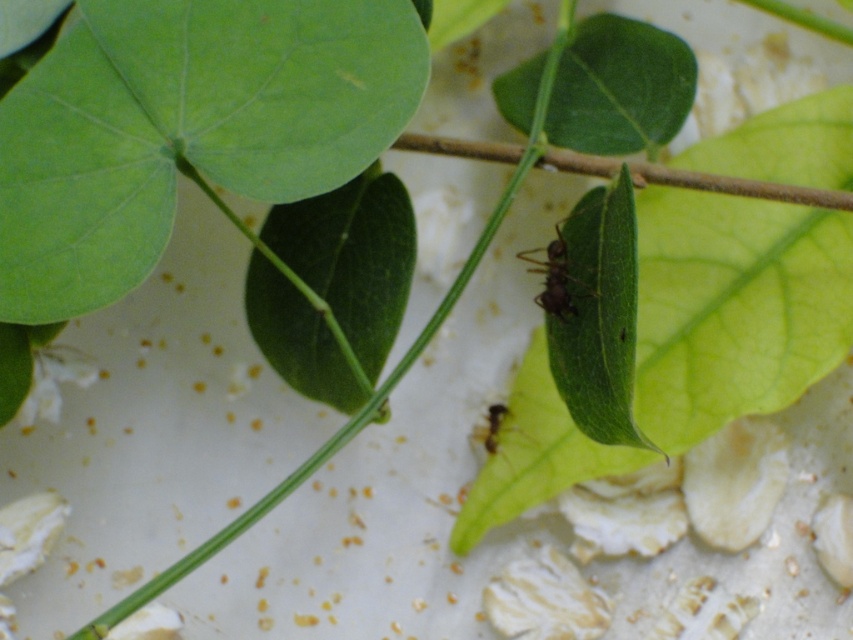
Question: Does brown matte ant at center have a larger size compared to green matte ant at center?

Choices:
 (A) no
 (B) yes

Answer: (B)

Question: Among these objects, which one is farthest from the camera?

Choices:
 (A) brown matte ant at center
 (B) green matte ant at center

Answer: (B)

Question: Among these objects, which one is farthest from the camera?

Choices:
 (A) green matte ant at center
 (B) green matte leaf at center
 (C) brown matte ant at center

Answer: (A)

Question: Can you confirm if brown matte ant at center is positioned to the right of green matte ant at center?

Choices:
 (A) no
 (B) yes

Answer: (B)

Question: Which object is positioned closest to the green matte leaf at center?

Choices:
 (A) green matte ant at center
 (B) brown matte ant at center

Answer: (B)

Question: Is brown matte ant at center to the left of green matte ant at center from the viewer's perspective?

Choices:
 (A) yes
 (B) no

Answer: (B)